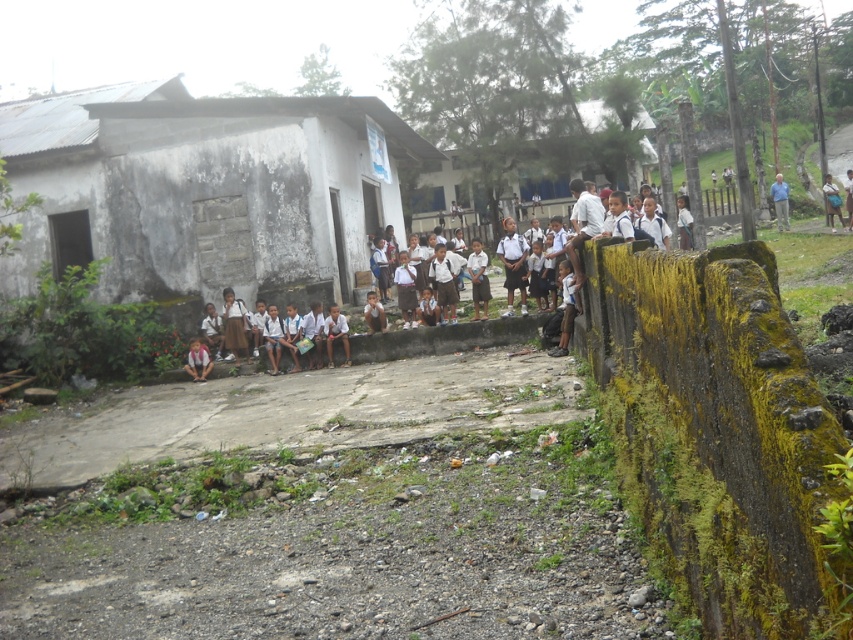
Does white stone building at left come behind light brown wooden chair at upper right?

No, white stone building at left is closer to the viewer.

Is point (36, 218) more distant than point (834, 192)?

No, (36, 218) is closer to viewer.

Where is `white stone building at left`? The image size is (853, 640). white stone building at left is located at coordinates (204, 192).

Which is behind, point (28, 236) or point (595, 100)?

The point (595, 100) is behind.

Can you confirm if white stone building at left is positioned below white matte hut at upper center?

Yes.

Does point (175, 99) lie behind point (469, 209)?

No.

Identify the location of white stone building at left. (204, 192).

Is the position of white matte hut at upper center less distant than that of light brown wooden chair at upper right?

No, it is not.

In the scene shown: Is white matte hut at upper center taller than light brown wooden chair at upper right?

Correct, white matte hut at upper center is much taller as light brown wooden chair at upper right.

Measure the distance between point (x=605, y=120) and camera.

The distance of point (x=605, y=120) from camera is 32.74 meters.

Locate an element on the screen. white matte hut at upper center is located at coordinates (447, 198).